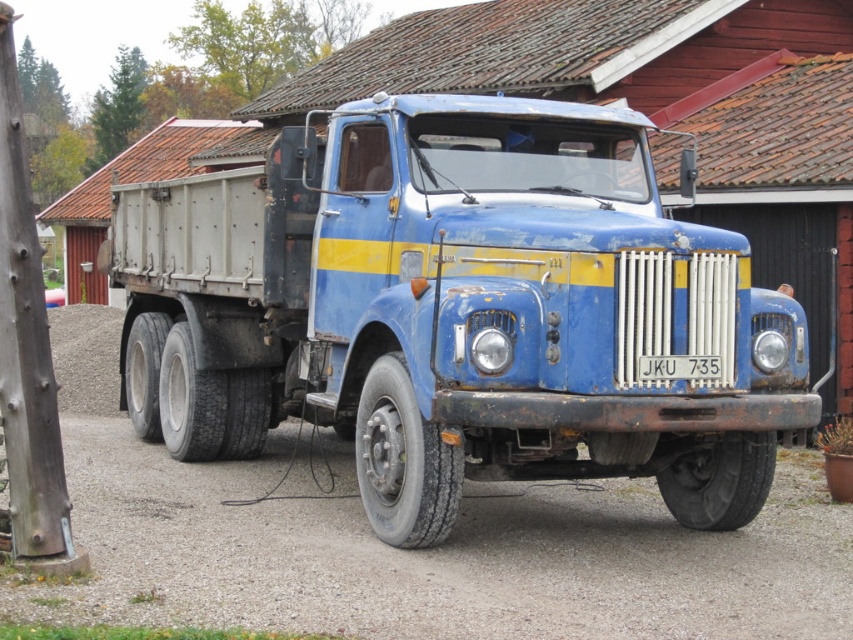
You are a delivery driver who needs to back up the rusty metal trailer truck at center into a loading dock that is 6 meters away. Can you safely maneuver the truck into the dock without hitting anything?

The distance between the rusty metal trailer truck at center and the camera is 5.91 meters. Since the loading dock is 6 meters away, the truck can safely maneuver into the dock as the distance is sufficient.

You are a delivery driver who needs to park your rusty metal trailer truck at center in a parking lot. The parking lot has a rusty metal dirt track at center as the only available space. Can your truck fit in the space?

The rusty metal trailer truck at center occupies less space than the rusty metal dirt track at center, so yes, the truck can fit in the space.